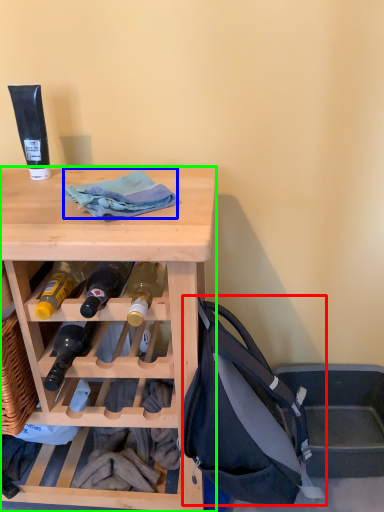
Question: Estimate the real-world distances between objects in this image. Which object is farther from handbag (highlighted by a red box), cloth (highlighted by a blue box) or desk (highlighted by a green box)?

Choices:
 (A) cloth
 (B) desk

Answer: (A)